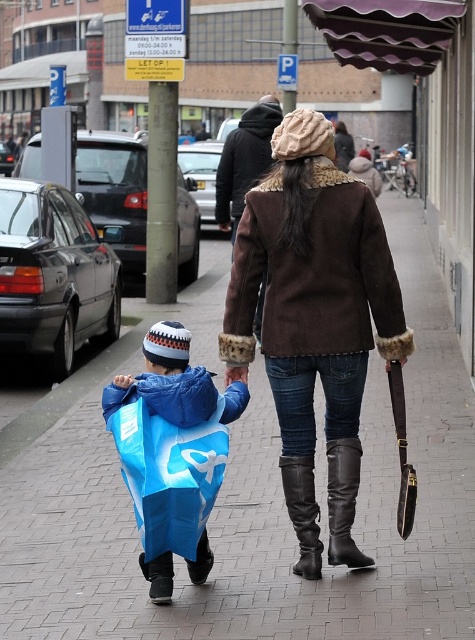
You are a delivery robot with a package that is 25 inches long. You need to place the package between the blue fabric bag at lower left and the black leather boot at lower center. Is there enough space?

The blue fabric bag at lower left is 25.22 inches from the black leather boot at lower center, so yes, the delivery robot can place the 25 inch package between them since there is sufficient space.

You are a delivery robot that needs to place a package on the brick pavement at center. However, there is a black leather boot at center in the way. Can you fit the package next to the boot without moving it?

The brick pavement at center is wider than the black leather boot at center, so yes, the package can be placed next to the boot since there is enough space.